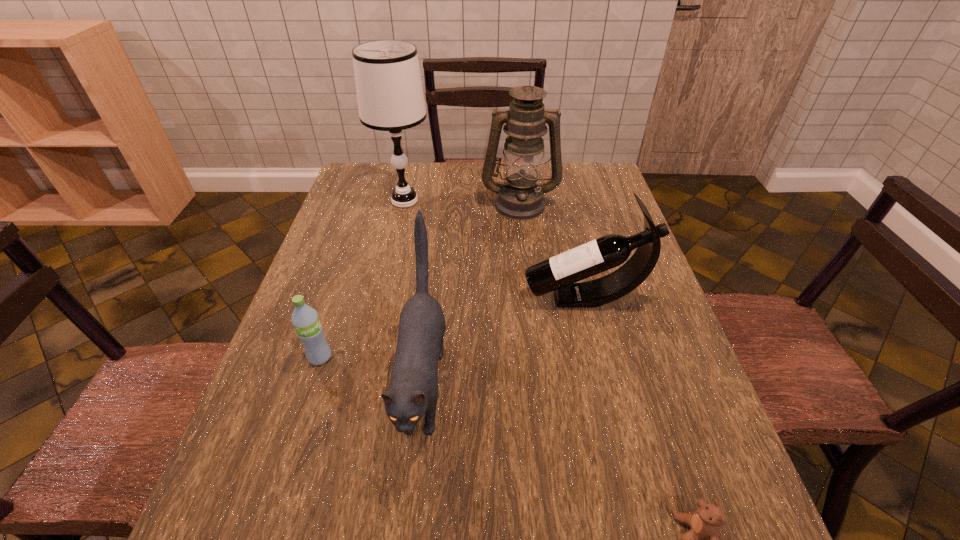
What are the coordinates of `free space at the right edge` in the screenshot? It's located at (732, 511).

Find the location of a particular element. This screenshot has width=960, height=540. free space between the table lamp and the cat is located at coordinates (415, 294).

What are the coordinates of `vacant region between the tallest object and the cat` in the screenshot? It's located at (415, 294).

Identify the location of free spot between the wine bottle and the fifth tallest object. Image resolution: width=960 pixels, height=540 pixels. (452, 327).

Where is `unoccupied position between the tallest object and the cat`? The width and height of the screenshot is (960, 540). unoccupied position between the tallest object and the cat is located at coordinates (415, 294).

Locate an element on the screen. Image resolution: width=960 pixels, height=540 pixels. object that stands as the fourth closest to the teddy bear is located at coordinates (520, 198).

The width and height of the screenshot is (960, 540). Identify the location of object that is the fourth closest to the table lamp. (309, 330).